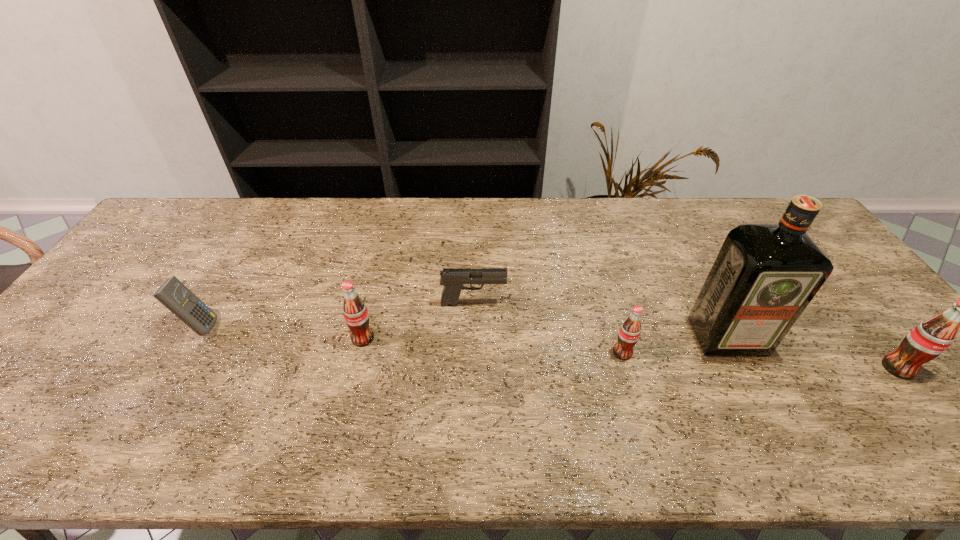
This screenshot has height=540, width=960. In order to click on the fourth shortest object in this screenshot , I will do `click(356, 316)`.

Find the location of a particular element. This screenshot has width=960, height=540. the leftmost soda is located at coordinates (356, 316).

You are a GUI agent. You are given a task and a screenshot of the screen. Output one action in this format:
    pyautogui.click(x=<x>, y=<y>)
    Task: Click on the second soda from left to right
    
    Given the screenshot: What is the action you would take?
    pyautogui.click(x=629, y=332)

The width and height of the screenshot is (960, 540). What are the coordinates of `the fourth object from left to right` in the screenshot? It's located at (629, 332).

I want to click on the rightmost soda, so click(x=929, y=339).

Identify the location of the second object from right to left. This screenshot has height=540, width=960. (764, 276).

Locate an element on the screen. liquor is located at coordinates (764, 276).

Find the location of a particular element. the leftmost object is located at coordinates (173, 294).

Image resolution: width=960 pixels, height=540 pixels. Find the location of `the shortest object`. the shortest object is located at coordinates (452, 279).

Identify the location of the third object from left to right. The height and width of the screenshot is (540, 960). (452, 279).